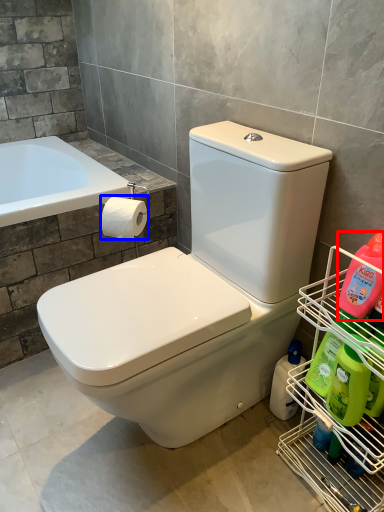
Question: Which of the following is the farthest to the observer, cleaning product (highlighted by a red box) or toilet paper (highlighted by a blue box)?

Choices:
 (A) cleaning product
 (B) toilet paper

Answer: (B)